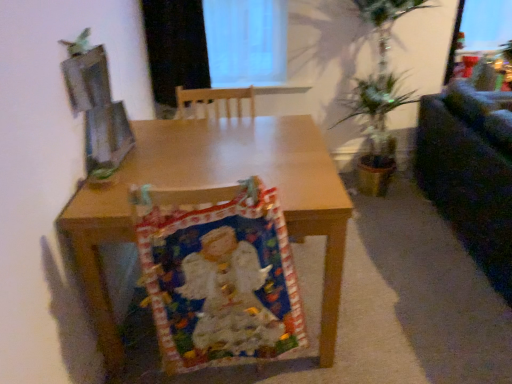
Question: Is multicolored fabric at center shorter than black matte curtain at upper center?

Choices:
 (A) yes
 (B) no

Answer: (B)

Question: Are multicolored fabric at center and black matte curtain at upper center far apart?

Choices:
 (A) no
 (B) yes

Answer: (B)

Question: Is multicolored fabric at center in front of black matte curtain at upper center?

Choices:
 (A) yes
 (B) no

Answer: (A)

Question: From the image's perspective, would you say multicolored fabric at center is shown under black matte curtain at upper center?

Choices:
 (A) no
 (B) yes

Answer: (B)

Question: Is multicolored fabric at center aimed at black matte curtain at upper center?

Choices:
 (A) yes
 (B) no

Answer: (B)

Question: From the image's perspective, is black matte curtain at upper center positioned above or below dark fabric couch at right?

Choices:
 (A) above
 (B) below

Answer: (A)

Question: Is black matte curtain at upper center in front of or behind dark fabric couch at right in the image?

Choices:
 (A) front
 (B) behind

Answer: (B)

Question: From a real-world perspective, relative to dark fabric couch at right, is black matte curtain at upper center vertically above or below?

Choices:
 (A) above
 (B) below

Answer: (A)

Question: Would you say black matte curtain at upper center is to the left or to the right of dark fabric couch at right in the picture?

Choices:
 (A) right
 (B) left

Answer: (B)

Question: In terms of height, does black matte curtain at upper center look taller or shorter compared to wooden desk at center?

Choices:
 (A) tall
 (B) short

Answer: (B)

Question: In the image, is black matte curtain at upper center positioned in front of or behind wooden desk at center?

Choices:
 (A) behind
 (B) front

Answer: (A)

Question: In the image, is black matte curtain at upper center on the left side or the right side of wooden desk at center?

Choices:
 (A) left
 (B) right

Answer: (A)

Question: Is point (169, 69) positioned closer to the camera than point (338, 294)?

Choices:
 (A) closer
 (B) farther

Answer: (B)

Question: In the image, is black matte curtain at upper center positioned in front of or behind multicolored fabric at center?

Choices:
 (A) front
 (B) behind

Answer: (B)

Question: Looking at the image, does black matte curtain at upper center seem bigger or smaller compared to multicolored fabric at center?

Choices:
 (A) big
 (B) small

Answer: (B)